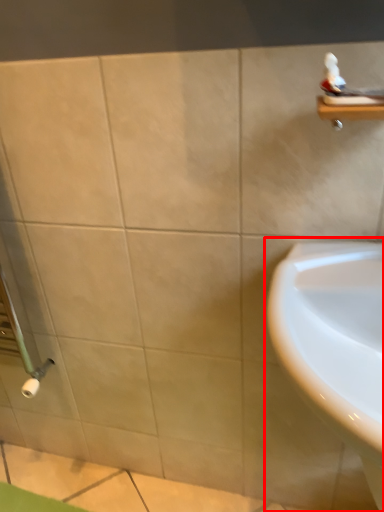
Question: In this image, where is sink (annotated by the red box) located relative to balustrade?

Choices:
 (A) right
 (B) left

Answer: (B)